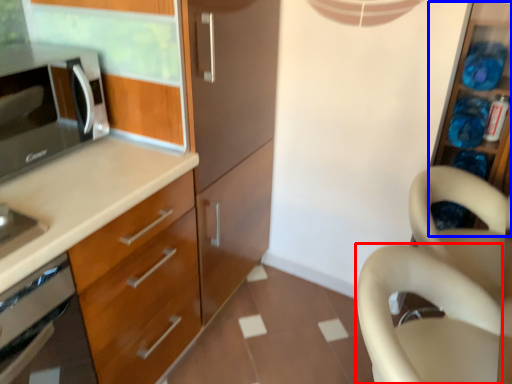
Question: Among these objects, which one is farthest to the camera, swivel chair (highlighted by a red box) or cabinet (highlighted by a blue box)?

Choices:
 (A) swivel chair
 (B) cabinet

Answer: (B)